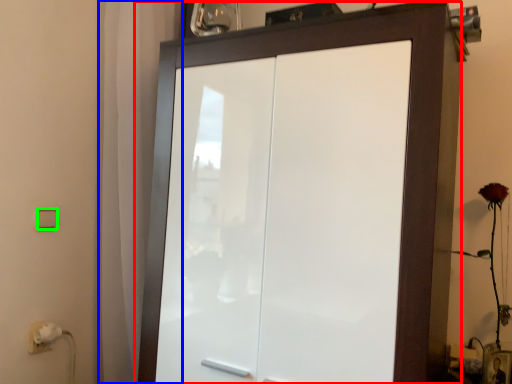
Question: Which object is the farthest from cupboard (highlighted by a red box)? Choose among these: curtain (highlighted by a blue box) or light switch (highlighted by a green box).

Choices:
 (A) curtain
 (B) light switch

Answer: (B)